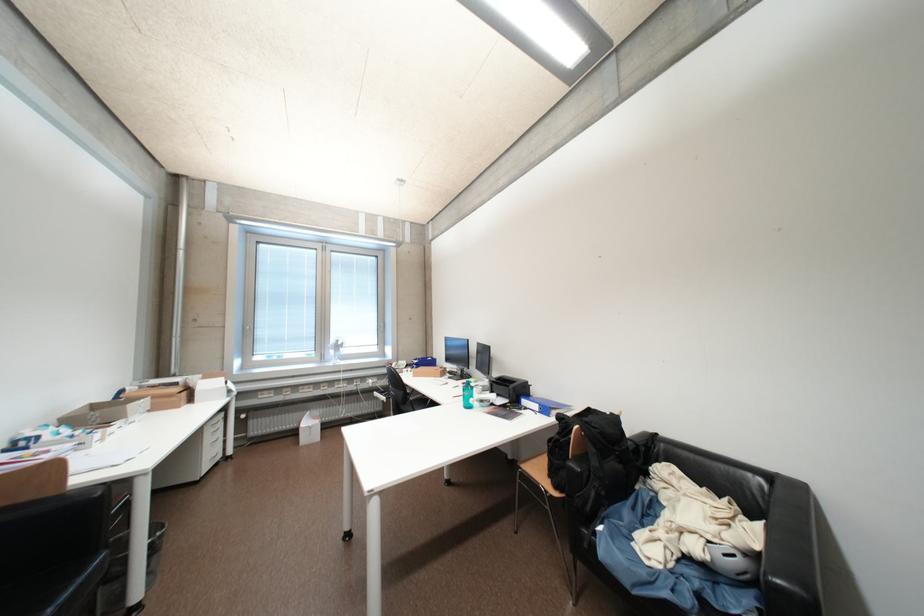
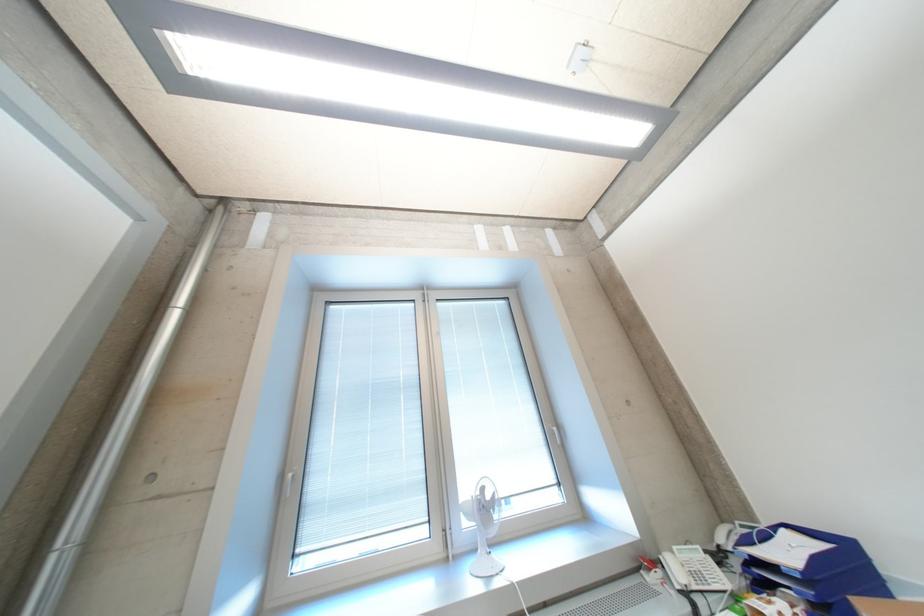
The point at (346, 349) is marked in the first image. Where is the corresponding point in the second image?

(492, 509)